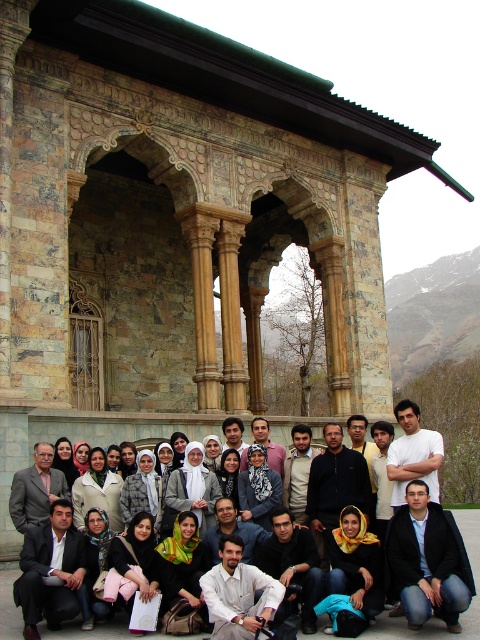
Question: Which of the following is the closest to the observer?

Choices:
 (A) dark blue jeans at lower right
 (B) white cotton shirt at center

Answer: (B)

Question: Observing the image, what is the correct spatial positioning of white cotton shirt at center in reference to dark blue jeans at lower right?

Choices:
 (A) below
 (B) above

Answer: (A)

Question: Among these points, which one is nearest to the camera?

Choices:
 (A) (406, 504)
 (B) (12, 433)

Answer: (A)

Question: Is the position of white cotton shirt at center more distant than that of dark blue jeans at lower right?

Choices:
 (A) no
 (B) yes

Answer: (A)

Question: Which point is closer to the camera?

Choices:
 (A) white cotton shirt at center
 (B) dark blue jeans at lower right

Answer: (A)

Question: Considering the relative positions of white cotton shirt at center and dark blue jeans at lower right in the image provided, where is white cotton shirt at center located with respect to dark blue jeans at lower right?

Choices:
 (A) above
 (B) below

Answer: (B)